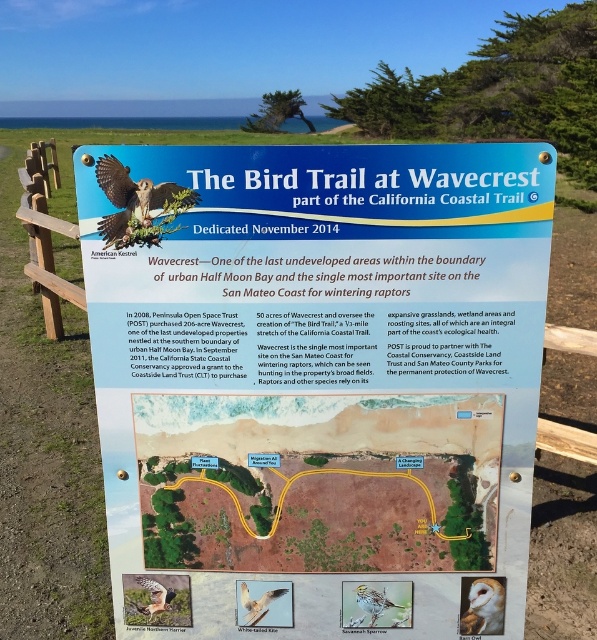
What is the spatial relationship between the white feathered bird at center and the brown speckled feathers at center on the signboard?

The white feathered bird at center is positioned on the right side of the brown speckled feathers at center.

You are standing in front of the signboard and want to touch the matte brown eagle at upper left with your hand. Can you reach it?

The matte brown eagle at upper left is 1.34 meters away from the viewer, so yes, you can reach it with your hand since it is within arm length.